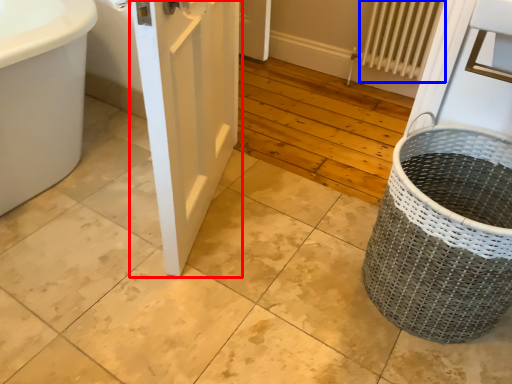
Question: Which object is closer to the camera taking this photo, door (highlighted by a red box) or radiator (highlighted by a blue box)?

Choices:
 (A) door
 (B) radiator

Answer: (A)